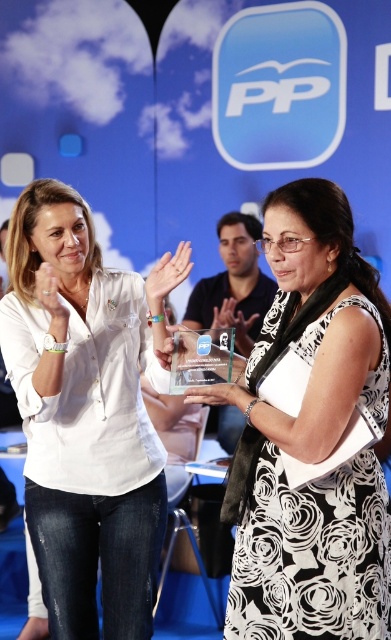
Question: Which of the following is the farthest from the observer?

Choices:
 (A) black and white floral dress at center
 (B) matte plastic award at center
 (C) white cotton shirt at center
 (D) matte white hand at center

Answer: (C)

Question: Which object is closer to the camera taking this photo?

Choices:
 (A) black and white floral dress at center
 (B) matte white hand at center

Answer: (A)

Question: Is white cotton shirt at center above matte white hand at center?

Choices:
 (A) yes
 (B) no

Answer: (B)

Question: Which of the following is the closest to the observer?

Choices:
 (A) matte plastic award at center
 (B) black and white floral dress at center
 (C) white cotton shirt at center
 (D) matte white hand at center

Answer: (B)

Question: From the image, what is the correct spatial relationship of white cotton shirt at center in relation to black and white floral dress at center?

Choices:
 (A) below
 (B) above

Answer: (A)

Question: Can you confirm if black and white floral dress at center is wider than matte white hand at center?

Choices:
 (A) no
 (B) yes

Answer: (B)